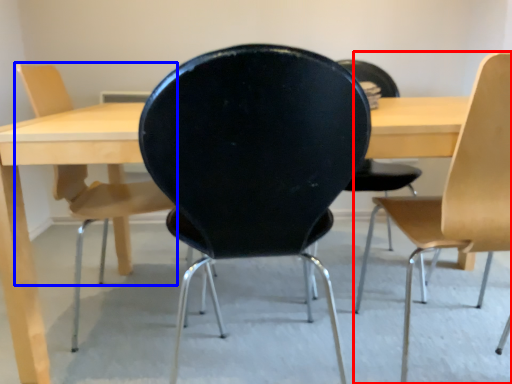
Question: Which object appears farthest to the camera in this image, chair (highlighted by a red box) or chair (highlighted by a blue box)?

Choices:
 (A) chair
 (B) chair

Answer: (B)